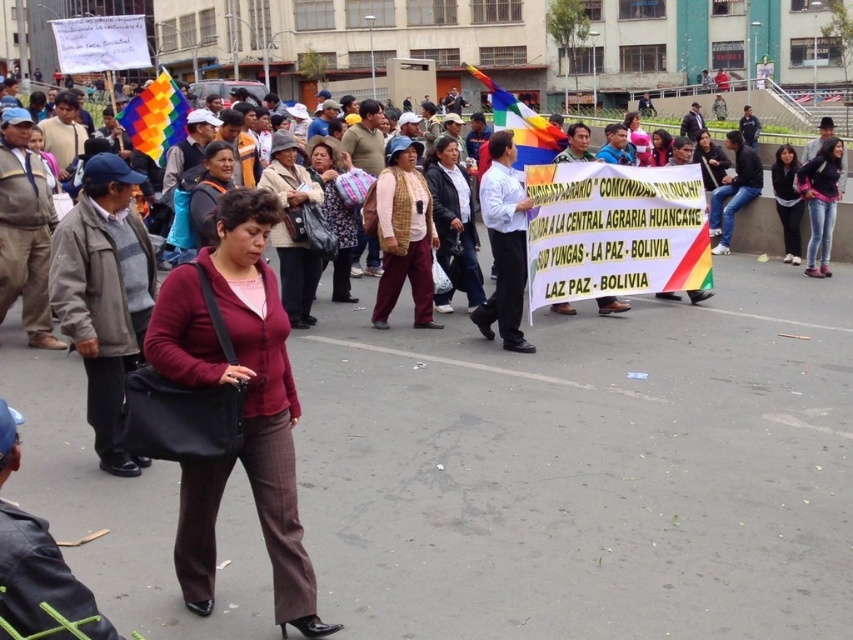
Question: Is maroon fabric jacket at center positioned in front of knitted sweater at center?

Choices:
 (A) no
 (B) yes

Answer: (B)

Question: Among these points, which one is nearest to the camera?

Choices:
 (A) (149, 109)
 (B) (798, 164)

Answer: (A)

Question: Can you confirm if knitted sweater at center is positioned to the right of dark blue jeans at upper right?

Choices:
 (A) yes
 (B) no

Answer: (B)

Question: Which point is farther to the camera?

Choices:
 (A) (798, 202)
 (B) (294, 282)
 (C) (171, 314)
 (D) (694, 150)

Answer: (D)

Question: Does rainbow fabric flag at center have a smaller size compared to matte black jacket at center?

Choices:
 (A) no
 (B) yes

Answer: (A)

Question: Which of the following is the farthest from the observer?

Choices:
 (A) (299, 188)
 (B) (320, 136)
 (C) (704, 141)
 (D) (805, 172)

Answer: (C)